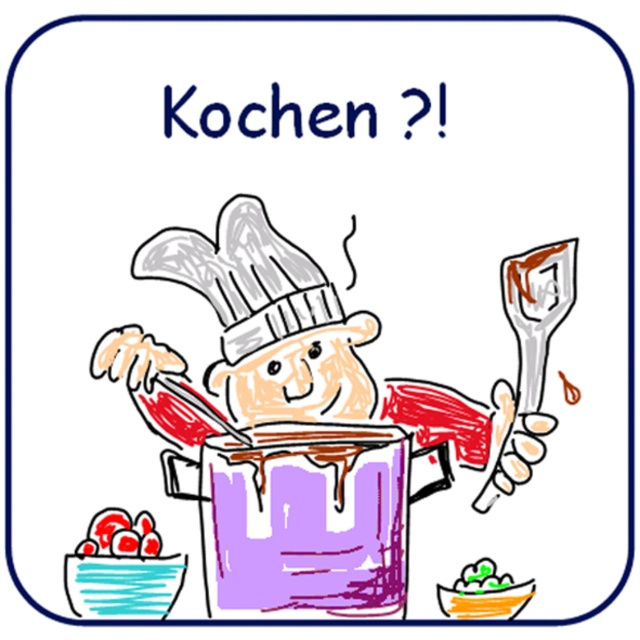
Does green matte bowl at lower center appear over smooth red tomatoes at lower left?

Actually, green matte bowl at lower center is below smooth red tomatoes at lower left.

Who is more distant from viewer, (481, 605) or (92, 552)?

The point (481, 605) is behind.

Find the location of a particular element. The width and height of the screenshot is (640, 640). green matte bowl at lower center is located at coordinates (483, 593).

Is smooth red chef at center to the left of green matte bowl at lower center from the viewer's perspective?

Correct, you'll find smooth red chef at center to the left of green matte bowl at lower center.

Who is positioned more to the right, smooth red chef at center or green matte bowl at lower center?

From the viewer's perspective, green matte bowl at lower center appears more on the right side.

Describe the element at coordinates (323, 364) in the screenshot. I see `smooth red chef at center` at that location.

You are a GUI agent. You are given a task and a screenshot of the screen. Output one action in this format:
    pyautogui.click(x=<x>, y=<y>)
    Task: Click on the smooth red chef at center
    Image resolution: width=640 pixels, height=640 pixels.
    Given the screenshot: What is the action you would take?
    pyautogui.click(x=323, y=364)

Does smooth red chef at center have a lesser width compared to smooth red tomatoes at lower left?

Incorrect, smooth red chef at center's width is not less than smooth red tomatoes at lower left's.

You are a GUI agent. You are given a task and a screenshot of the screen. Output one action in this format:
    pyautogui.click(x=<x>, y=<y>)
    Task: Click on the smooth red chef at center
    
    Given the screenshot: What is the action you would take?
    click(323, 364)